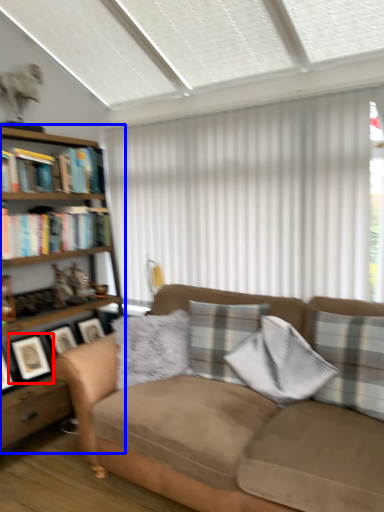
Question: Which point is closer to the camera, picture frame (highlighted by a red box) or bookcase (highlighted by a blue box)?

Choices:
 (A) picture frame
 (B) bookcase

Answer: (B)